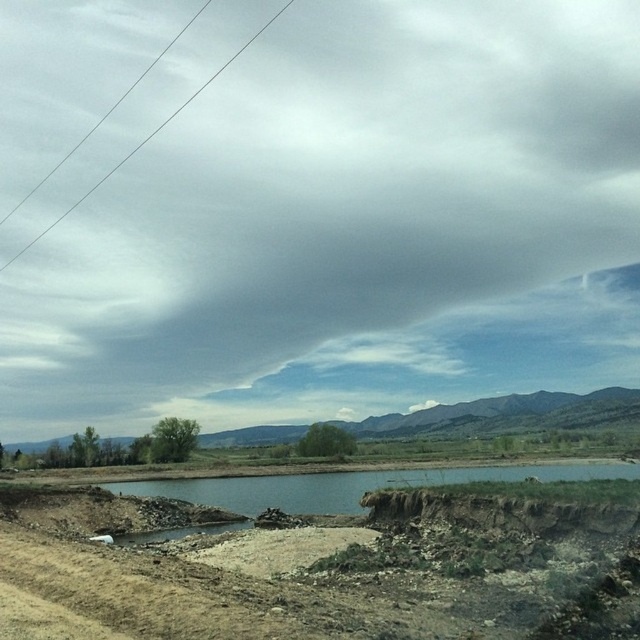
You are a hiker who wants to cross the brown dirt puddle at lower center. There is a smooth wire at upper left nearby. Which object is located more to the left side?

The smooth wire at upper left is positioned on the left side of brown dirt puddle at lower center, so the smooth wire at upper left is more to the left.